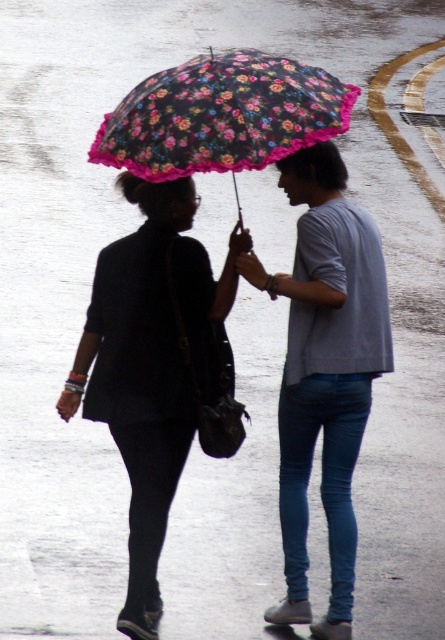
Consider the image. Can you confirm if light gray cotton shirt at center is taller than floral-patterned fabric umbrella at upper center?

Indeed, light gray cotton shirt at center has a greater height compared to floral-patterned fabric umbrella at upper center.

Who is more distant from viewer, (326, 451) or (140, 161)?

Point (326, 451)

Find the location of `light gray cotton shirt at center`. light gray cotton shirt at center is located at coordinates (324, 371).

Locate an element on the screen. The width and height of the screenshot is (445, 640). light gray cotton shirt at center is located at coordinates (324, 371).

Does matte black jacket at left appear on the right side of light gray cotton shirt at center?

No, matte black jacket at left is not to the right of light gray cotton shirt at center.

Is matte black jacket at left shorter than light gray cotton shirt at center?

Yes, matte black jacket at left is shorter than light gray cotton shirt at center.

At what (x,y) coordinates should I click in order to perform the action: click on matte black jacket at left. Please return your answer as a coordinate pair (x, y). This screenshot has height=640, width=445. Looking at the image, I should click on (152, 365).

Which is behind, point (137, 371) or point (211, 164)?

Positioned behind is point (137, 371).

At what (x,y) coordinates should I click in order to perform the action: click on matte black jacket at left. Please return your answer as a coordinate pair (x, y). Looking at the image, I should click on (152, 365).

Between point (174, 380) and point (96, 152), which one is positioned in front?

Positioned in front is point (174, 380).

Find the location of a particular element. The height and width of the screenshot is (640, 445). matte black jacket at left is located at coordinates (152, 365).